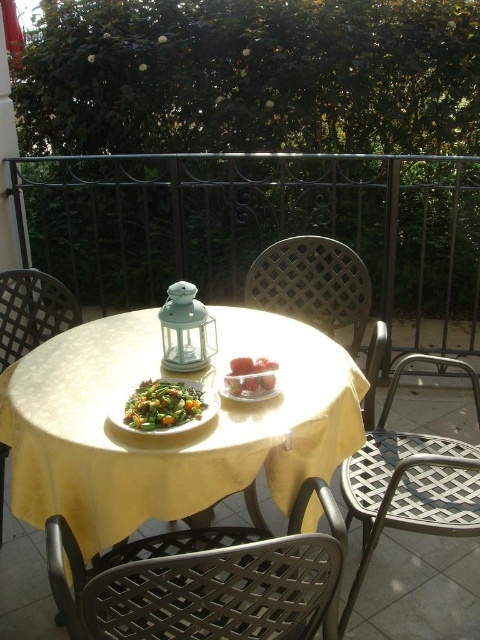
Question: Which point is closer to the camera taking this photo?

Choices:
 (A) (180, 403)
 (B) (296, 240)
 (C) (211, 310)
 (D) (0, 525)

Answer: (A)

Question: Which object appears closest to the camera in this image?

Choices:
 (A) metallic lattice chair at lower left
 (B) green matte vegetables at center
 (C) metallic lattice chair at lower right
 (D) metallic lattice chair at center

Answer: (A)

Question: Which object is the closest to the smooth glass bowl at center?

Choices:
 (A) metallic lattice chair at center
 (B) yellow fabric table at center

Answer: (B)

Question: Is metallic mesh chair at left smaller than green matte vegetables at center?

Choices:
 (A) no
 (B) yes

Answer: (A)

Question: Can you confirm if metallic lattice chair at lower right is positioned to the right of smooth glass bowl at center?

Choices:
 (A) yes
 (B) no

Answer: (A)

Question: Can you confirm if metallic lattice chair at lower right is smaller than green matte vegetables at center?

Choices:
 (A) no
 (B) yes

Answer: (A)